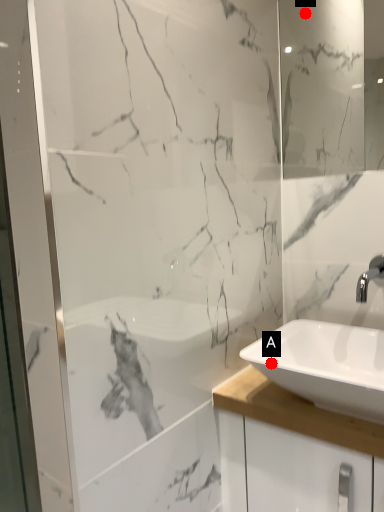
Question: Two points are circled on the image, labeled by A and B beside each circle. Which of the following is the farthest from the observer?

Choices:
 (A) A is further
 (B) B is further

Answer: (B)